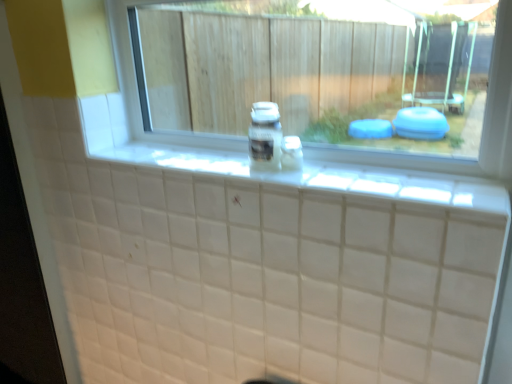
You are a GUI agent. You are given a task and a screenshot of the screen. Output one action in this format:
    pyautogui.click(x=<x>, y=<y>)
    Task: Click on the transparent glass window at center
    The image size is (512, 384).
    Given the screenshot: What is the action you would take?
    pyautogui.click(x=483, y=128)

This screenshot has height=384, width=512. What do you see at coordinates (322, 177) in the screenshot? I see `white tile ledge at center` at bounding box center [322, 177].

At what (x,y) coordinates should I click in order to perform the action: click on clear plastic bottle at center. Please return your answer as a coordinate pair (x, y). Looking at the image, I should click on (265, 136).

The image size is (512, 384). I want to click on transparent glass window at center, so click(x=483, y=128).

From the image's perspective, would you say clear plastic bottle at center is positioned over transparent glass window at center?

No.

In the scene shown: Do you think clear plastic bottle at center is within transparent glass window at center, or outside of it?

clear plastic bottle at center lies outside transparent glass window at center.

Is clear plastic bottle at center positioned with its back to transparent glass window at center?

Yes, clear plastic bottle at center is positioned with its back facing transparent glass window at center.

From a real-world perspective, does clear plastic bottle at center stand above transparent glass window at center?

Incorrect, from a real-world perspective, clear plastic bottle at center is lower than transparent glass window at center.

Does white tile ledge at center have a greater width compared to transparent glass window at center?

Yes, white tile ledge at center is wider than transparent glass window at center.

Does white tile ledge at center have a lesser height compared to transparent glass window at center?

Indeed, white tile ledge at center has a lesser height compared to transparent glass window at center.

Is white tile ledge at center inside or outside of transparent glass window at center?

The correct answer is: outside.

How far apart are clear plastic bottle at center and white tile ledge at center?

10.29 inches.

Is clear plastic bottle at center spatially inside white tile ledge at center, or outside of it?

clear plastic bottle at center is located beyond the bounds of white tile ledge at center.

Which object is positioned more to the left, clear plastic bottle at center or white tile ledge at center?

Positioned to the left is clear plastic bottle at center.

Does point (269, 127) lie in front of point (396, 192)?

No, it is not.

Does transparent glass window at center lie in front of clear plastic bottle at center?

Yes, it is.

From a real-world perspective, which is physically above, transparent glass window at center or clear plastic bottle at center?

In real-world perspective, transparent glass window at center is above.

Who is bigger, transparent glass window at center or clear plastic bottle at center?

transparent glass window at center is bigger.

Between transparent glass window at center and clear plastic bottle at center, which one has more height?

transparent glass window at center.

Considering the relative sizes of white tile ledge at center and clear plastic bottle at center in the image provided, is white tile ledge at center wider than clear plastic bottle at center?

Yes, white tile ledge at center is wider than clear plastic bottle at center.

Which point is more forward, [372,171] or [280,166]?

The point [372,171] is closer.

How many degrees apart are the facing directions of white tile ledge at center and clear plastic bottle at center?

2.81 degrees separate the facing orientations of white tile ledge at center and clear plastic bottle at center.

From a real-world perspective, is white tile ledge at center physically above clear plastic bottle at center?

Actually, white tile ledge at center is physically below clear plastic bottle at center in the real world.

Is point (507, 7) closer to camera compared to point (310, 189)?

That is True.

Who is smaller, transparent glass window at center or white tile ledge at center?

white tile ledge at center is smaller.

Is transparent glass window at center turned away from white tile ledge at center?

No, transparent glass window at center's orientation is not away from white tile ledge at center.

The image size is (512, 384). Find the location of `window that is on the right side of clear plastic bottle at center`. window that is on the right side of clear plastic bottle at center is located at coordinates (483, 128).

Identify the location of window positioned vertically above the white tile ledge at center (from a real-world perspective). (483, 128).

When comparing their distances from white tile ledge at center, does clear plastic bottle at center or transparent glass window at center seem further?

Based on the image, transparent glass window at center appears to be further to white tile ledge at center.

Which object lies further to the anchor point clear plastic bottle at center, white tile ledge at center or transparent glass window at center?

Among the two, transparent glass window at center is located further to clear plastic bottle at center.

Considering their positions, is white tile ledge at center positioned further to transparent glass window at center than clear plastic bottle at center?

white tile ledge at center.

Based on their spatial positions, is clear plastic bottle at center or white tile ledge at center closer to transparent glass window at center?

Among the two, clear plastic bottle at center is located nearer to transparent glass window at center.

Consider the image. Looking at the image, which one is located closer to white tile ledge at center, transparent glass window at center or clear plastic bottle at center?

Based on the image, clear plastic bottle at center appears to be nearer to white tile ledge at center.

From the image, which object appears to be farther from clear plastic bottle at center, transparent glass window at center or white tile ledge at center?

transparent glass window at center is further to clear plastic bottle at center.

At what (x,y) coordinates should I click in order to perform the action: click on window between white tile ledge at center and clear plastic bottle at center in the front-back direction. Please return your answer as a coordinate pair (x, y). Looking at the image, I should click on (483, 128).